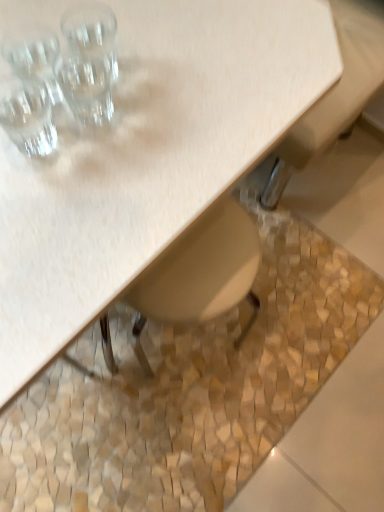
Where is `free space behind transparent glass at upper left, the 2th shot glass when ordered from top to bottom`? free space behind transparent glass at upper left, the 2th shot glass when ordered from top to bottom is located at coordinates pyautogui.click(x=114, y=34).